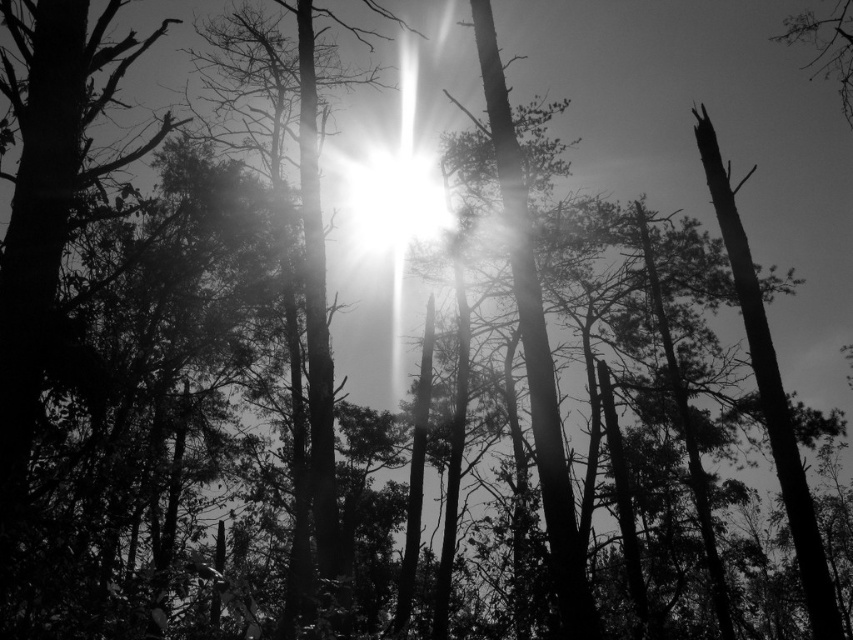
Question: In this image, where is smooth dark wood tree trunk at right located relative to bright white light at center?

Choices:
 (A) right
 (B) left

Answer: (A)

Question: Which object appears farthest from the camera in this image?

Choices:
 (A) smooth dark wood tree trunk at right
 (B) bright white light at center

Answer: (B)

Question: Can you confirm if bright white light at center is positioned below smooth bark tree at upper right?

Choices:
 (A) no
 (B) yes

Answer: (B)

Question: Is smooth dark wood tree trunk at right positioned behind bright white light at center?

Choices:
 (A) yes
 (B) no

Answer: (B)

Question: Which of the following is the closest to the observer?

Choices:
 (A) (799, 33)
 (B) (815, 554)

Answer: (B)

Question: Among these objects, which one is farthest from the camera?

Choices:
 (A) smooth bark tree at upper right
 (B) bright white light at center
 (C) smooth dark wood tree trunk at right

Answer: (B)